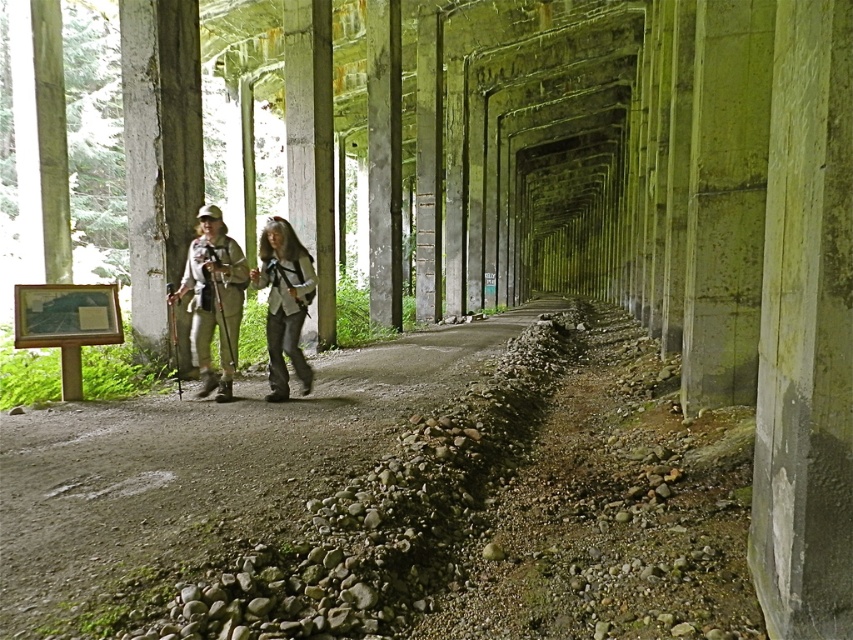
Question: Which of the following is the closest to the observer?

Choices:
 (A) (277, 340)
 (B) (276, 301)

Answer: (B)

Question: Among these objects, which one is nearest to the camera?

Choices:
 (A) gray fabric backpack at center
 (B) matte khaki pants at center

Answer: (B)

Question: Is matte khaki pants at center to the left of gray fabric backpack at center from the viewer's perspective?

Choices:
 (A) no
 (B) yes

Answer: (B)

Question: Does matte khaki pants at center lie behind gray fabric backpack at center?

Choices:
 (A) yes
 (B) no

Answer: (B)

Question: Can you confirm if matte khaki pants at center is bigger than gray fabric backpack at center?

Choices:
 (A) yes
 (B) no

Answer: (A)